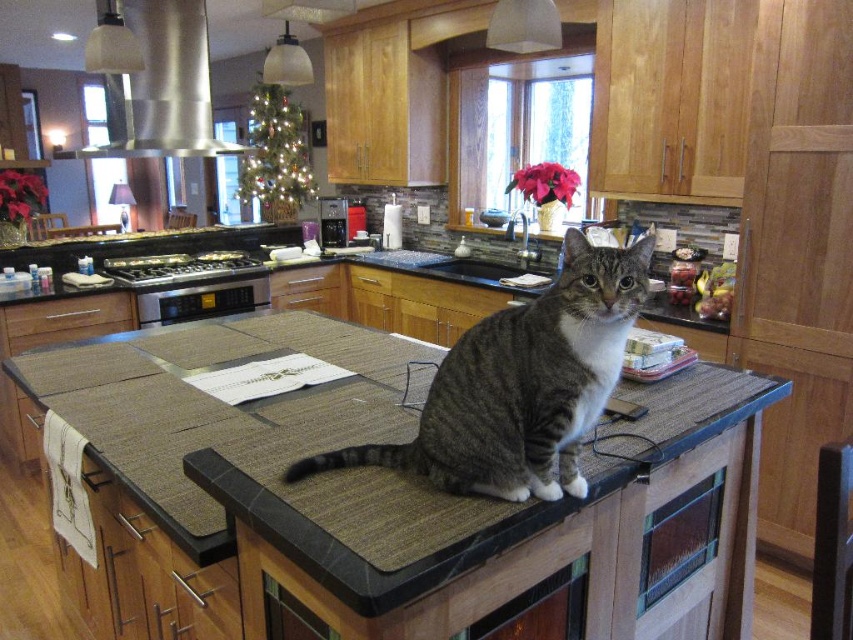
Is gray striped cat at center above satin silver exhaust hood at upper left?

No, gray striped cat at center is not above satin silver exhaust hood at upper left.

Does point (624, 252) come behind point (120, 106)?

No, it is in front of (120, 106).

Where is `gray striped cat at center`? gray striped cat at center is located at coordinates (521, 385).

Where is `gray striped cat at center`? Image resolution: width=853 pixels, height=640 pixels. gray striped cat at center is located at coordinates (521, 385).